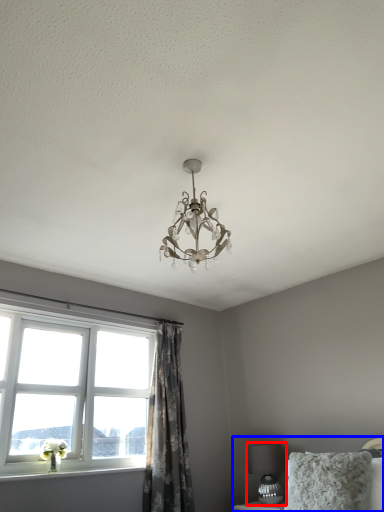
Question: Which object appears farthest to the camera in this image, table lamp (highlighted by a red box) or bed (highlighted by a blue box)?

Choices:
 (A) table lamp
 (B) bed

Answer: (A)